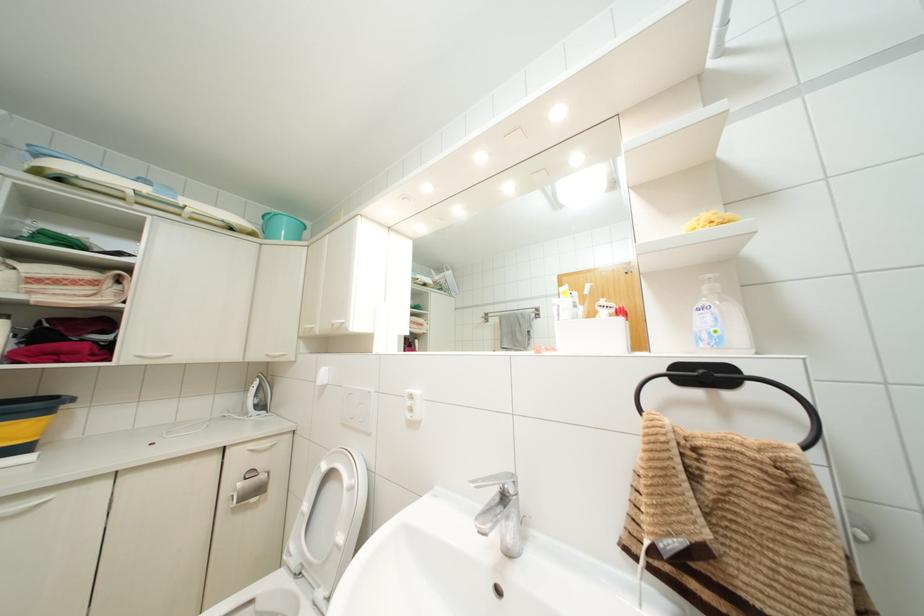
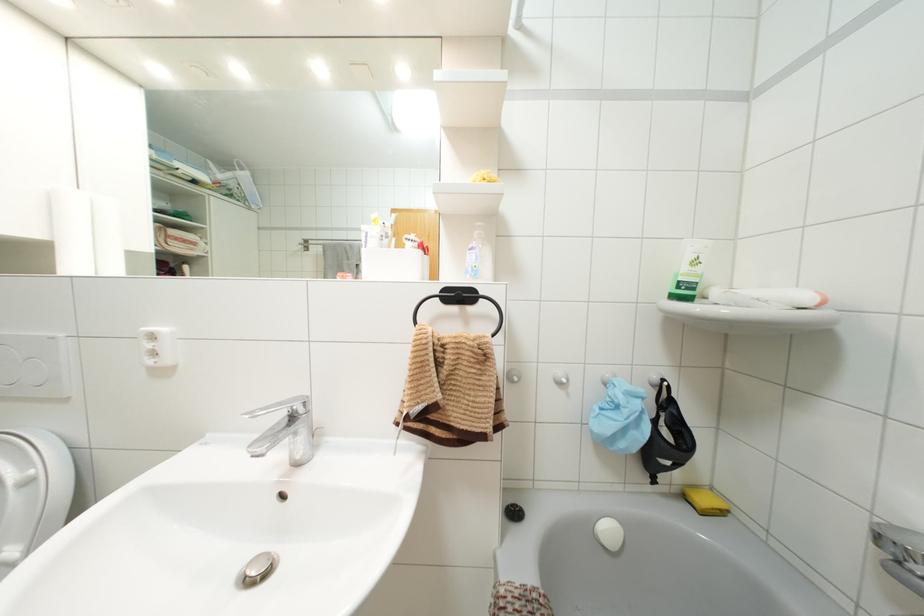
Question: The first image is from the beginning of the video and the second image is from the end. How did the camera likely rotate when shooting the video?

Choices:
 (A) Left
 (B) Right
 (C) Up
 (D) Down

Answer: (B)